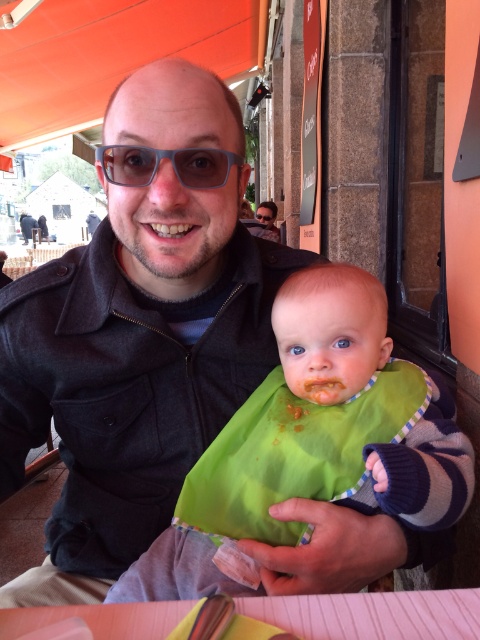
You are a photographer trying to capture a closeup of the pink paper at lower center without the matte black jacket at center blocking the view. Based on the scene description, can you position yourself in a way to achieve this?

The pink paper at lower center is in front of the matte black jacket at center, so positioning yourself directly facing the pink paper at lower center would allow you to capture it without obstruction from the matte black jacket at center.